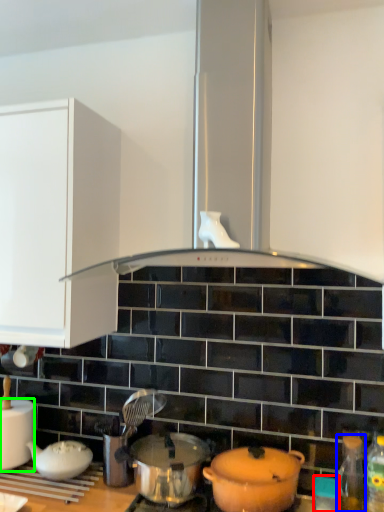
Question: Which is farther away from appliance (highlighted by a red box)? bottle (highlighted by a blue box) or kitchen appliance (highlighted by a green box)?

Choices:
 (A) bottle
 (B) kitchen appliance

Answer: (B)